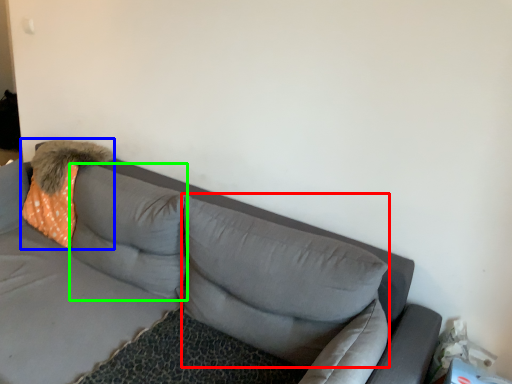
Question: Which is farther away from pillow (highlighted by a red box)? throw pillow (highlighted by a blue box) or pillow (highlighted by a green box)?

Choices:
 (A) throw pillow
 (B) pillow

Answer: (A)